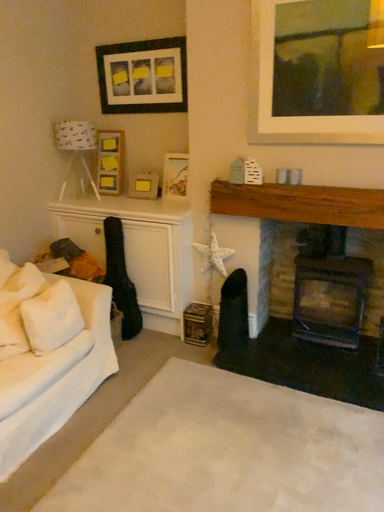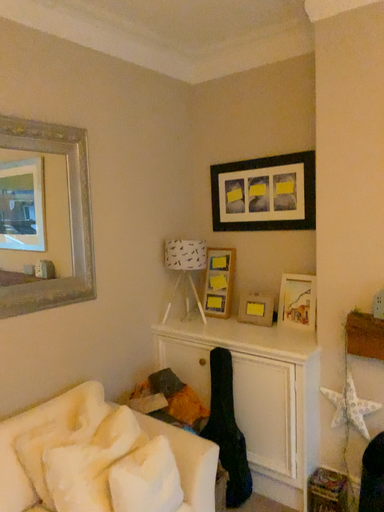
Question: Which way did the camera rotate in the video?

Choices:
 (A) rotated upward
 (B) rotated downward

Answer: (A)